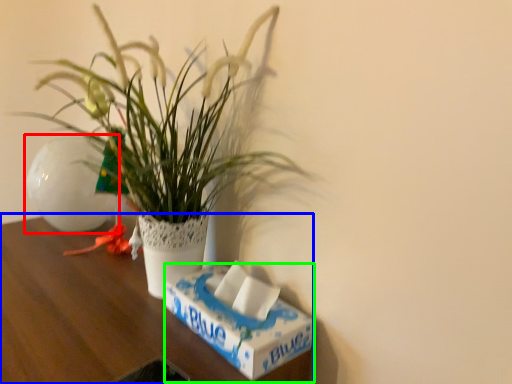
Question: Which object is the closest to the flowerpot (highlighted by a red box)? Choose among these: table (highlighted by a blue box) or box (highlighted by a green box).

Choices:
 (A) table
 (B) box

Answer: (A)